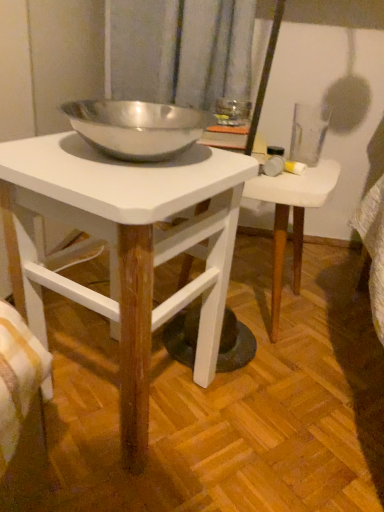
Where is `free location to the right of white matte table at center, which is the first table from front to back`? The image size is (384, 512). free location to the right of white matte table at center, which is the first table from front to back is located at coordinates (277, 420).